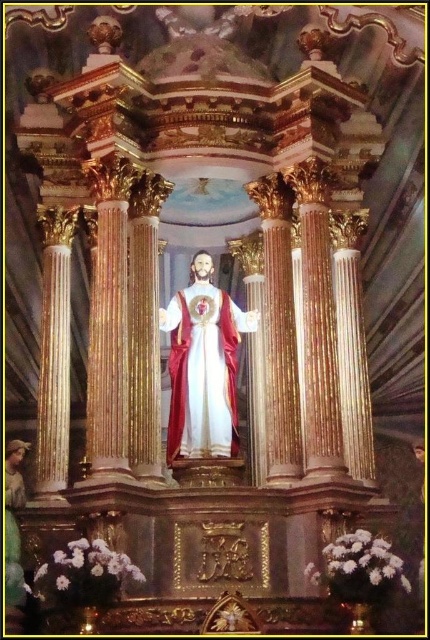
You are an architect designing a new church and want to place a golden cross exactly at the center of the dome above the white satin statue at center. According to the image, where should you place the golden cross relative to the statue?

The white satin statue at center is located at point [203,365], so the golden cross should be placed directly above it at the center of the dome, which would be vertically aligned with the statue.

You are an altar cleaner needing to reach both the white satin statue at center and the wooden statue at lower left. Which statue should you clean first if you want to avoid moving the other one afterward?

You should clean the wooden statue at lower left first because it is behind the white satin statue at center, so cleaning it first avoids having to move the white satin statue afterward.